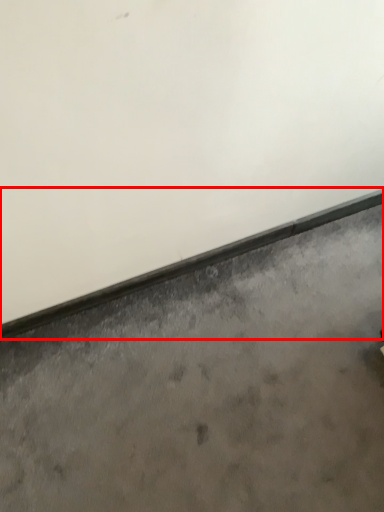
Question: From the image's perspective, where is window sill (annotated by the red box) located in relation to concrete in the image?

Choices:
 (A) above
 (B) below

Answer: (A)